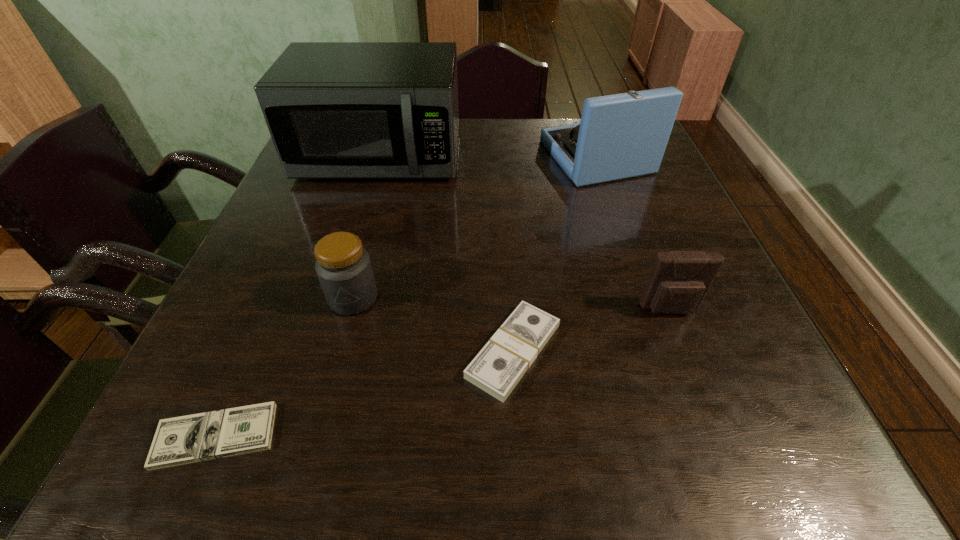
You are a GUI agent. You are given a task and a screenshot of the screen. Output one action in this format:
    pyautogui.click(x=<x>, y=<y>)
    Task: Click on the free spot that satisfies the following two spatial constraints: 1. on the front-facing side of the right dollar; 2. on the left side of the microwave oven
    
    Given the screenshot: What is the action you would take?
    pyautogui.click(x=323, y=351)

The height and width of the screenshot is (540, 960). I want to click on free point that satisfies the following two spatial constraints: 1. on the back side of the nearest object; 2. on the left side of the farther dollar, so click(252, 351).

This screenshot has width=960, height=540. I want to click on free point that satisfies the following two spatial constraints: 1. on the surface of the jar near the warning symbol; 2. on the left side of the fifth tallest object, so click(x=339, y=351).